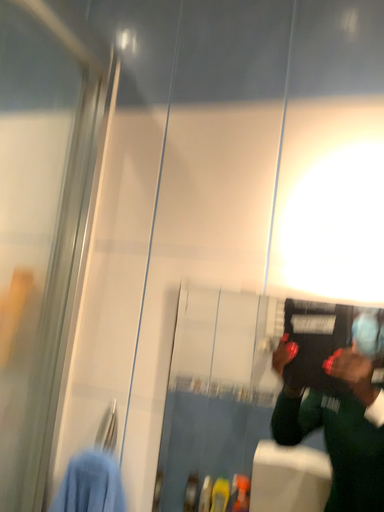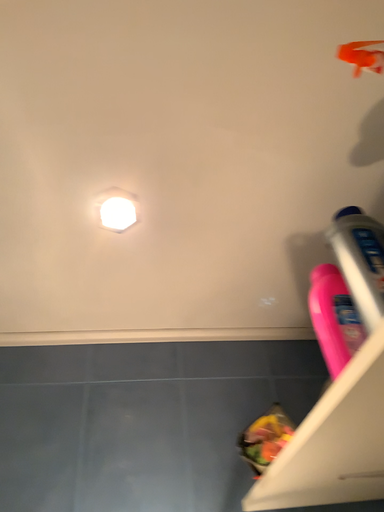
Question: How did the camera likely rotate when shooting the video?

Choices:
 (A) rotated left
 (B) rotated right

Answer: (B)